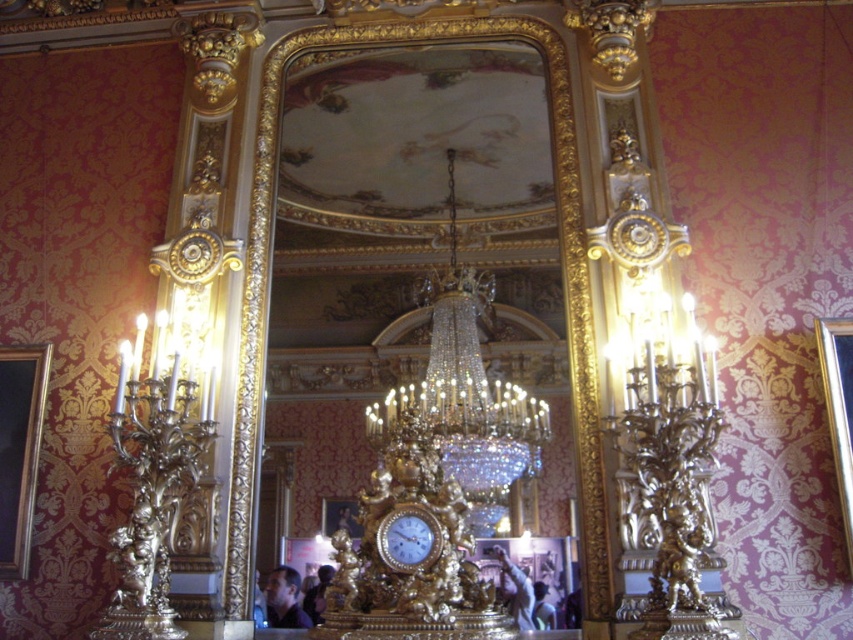
You are standing in the room and looking at the two points marked in the image. Which point, point (828, 332) or point (276, 582), is closer to you?

Point (828, 332) is closer to you than point (276, 582).